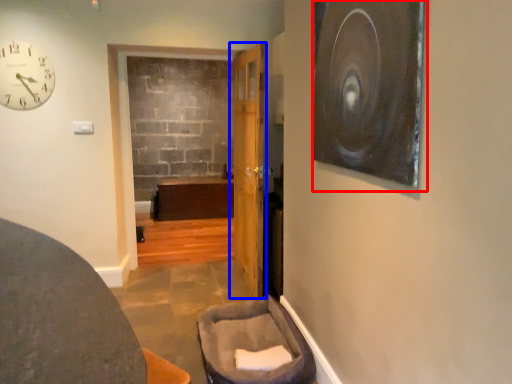
Question: Which point is further to the camera, picture frame (highlighted by a red box) or door (highlighted by a blue box)?

Choices:
 (A) picture frame
 (B) door

Answer: (B)